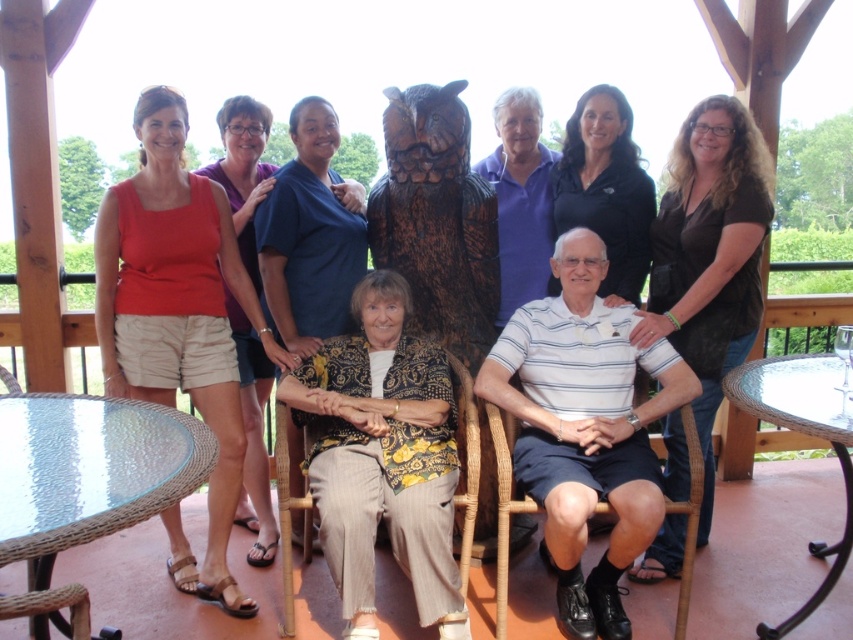
Between matte black owl at center and brown wicker chair at lower center, which one is positioned higher?

matte black owl at center

Does matte black owl at center have a smaller size compared to brown wicker chair at lower center?

Incorrect, matte black owl at center is not smaller in size than brown wicker chair at lower center.

Between point (726, 237) and point (506, 497), which one is positioned in front?

Point (506, 497)

Find the location of a particular element. The width and height of the screenshot is (853, 640). matte black owl at center is located at coordinates (416, 177).

Which of these two, matte blue shirt at center or brown wicker chair at lower center, stands shorter?

With less height is brown wicker chair at lower center.

Is matte blue shirt at center thinner than brown wicker chair at lower center?

No, matte blue shirt at center is not thinner than brown wicker chair at lower center.

You are a GUI agent. You are given a task and a screenshot of the screen. Output one action in this format:
    pyautogui.click(x=<x>, y=<y>)
    Task: Click on the matte blue shirt at center
    Image resolution: width=853 pixels, height=640 pixels.
    Given the screenshot: What is the action you would take?
    pyautogui.click(x=292, y=218)

Where is `matte blue shirt at center`? The image size is (853, 640). matte blue shirt at center is located at coordinates (292, 218).

Which is below, matte blue shirt at center or clear glass table at lower right?

Positioned lower is clear glass table at lower right.

In the scene shown: Who is higher up, matte blue shirt at center or clear glass table at lower right?

matte blue shirt at center is higher up.

Is point (337, 292) positioned before point (795, 388)?

No, it is behind (795, 388).

At what (x,y) coordinates should I click in order to perform the action: click on matte blue shirt at center. Please return your answer as a coordinate pair (x, y). Looking at the image, I should click on (292, 218).